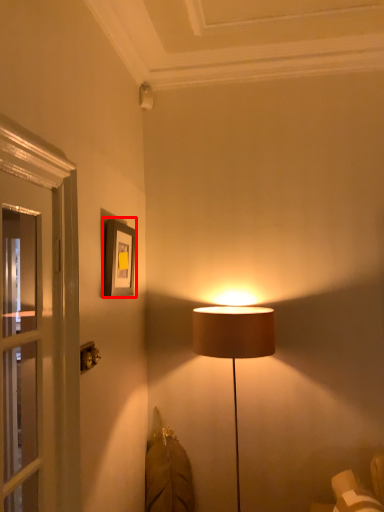
Question: From the image's perspective, where is picture frame (annotated by the red box) located in relation to electric outlet in the image?

Choices:
 (A) below
 (B) above

Answer: (B)